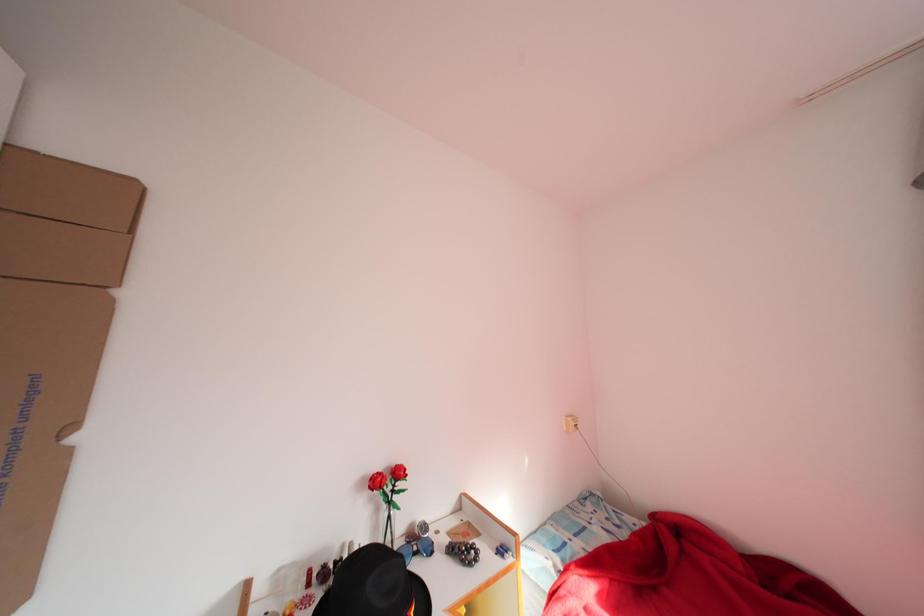
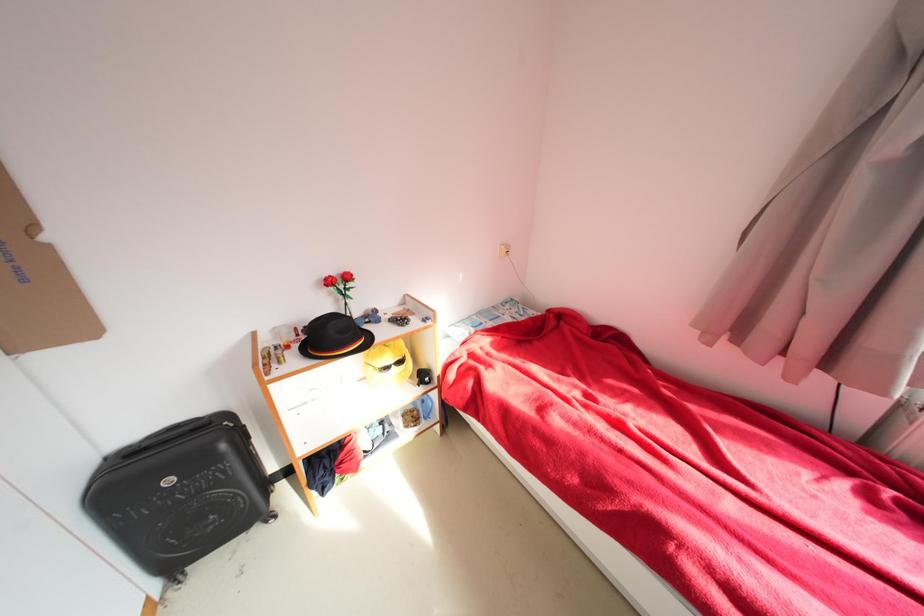
Question: Based on the continuous images, in which direction is the camera rotating? Reply with the corresponding letter.

Choices:
 (A) Left
 (B) Right
 (C) Up
 (D) Down

Answer: (D)